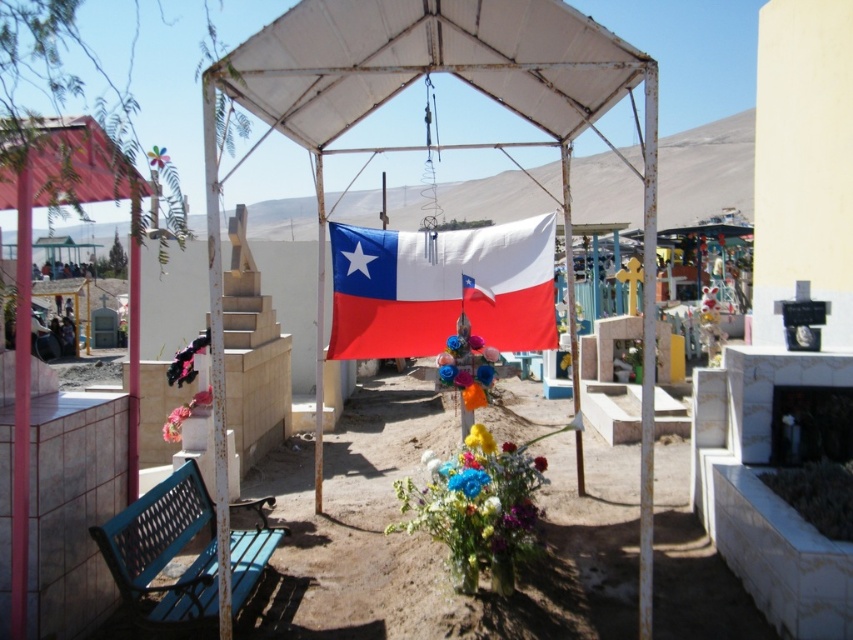
You are standing at the center of the cemetery scene and want to place a new memorial plaque on the wall near the blue bench. The plaque must be positioned above the pink fabric flower at lower left. Based on the coordinates provided, where should you place the plaque relative to the flower?

The pink fabric flower at lower left is located at point (183, 413). To place the plaque above it, position it at a higher y coordinate than 0.216 while maintaining the same x coordinate of 0.648.

You are standing at the center of the cemetery and want to place a new memorial plaque. The plaque must be placed exactly at the point indicated by the coordinates point [183,413]. Describe the exact location of this point in relation to the objects in the scene described in the scene.

The point [183,413] corresponds to the pink fabric flower at lower left, which is located to the left of the pavilion supporting the Chilean flag and near the blue bench with a lattice backrest positioned against the tiled wall.